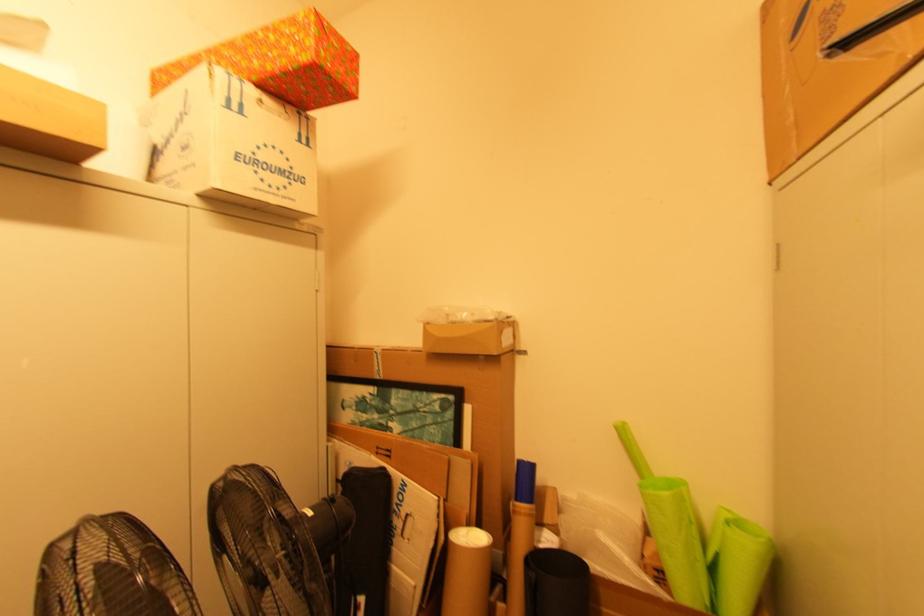
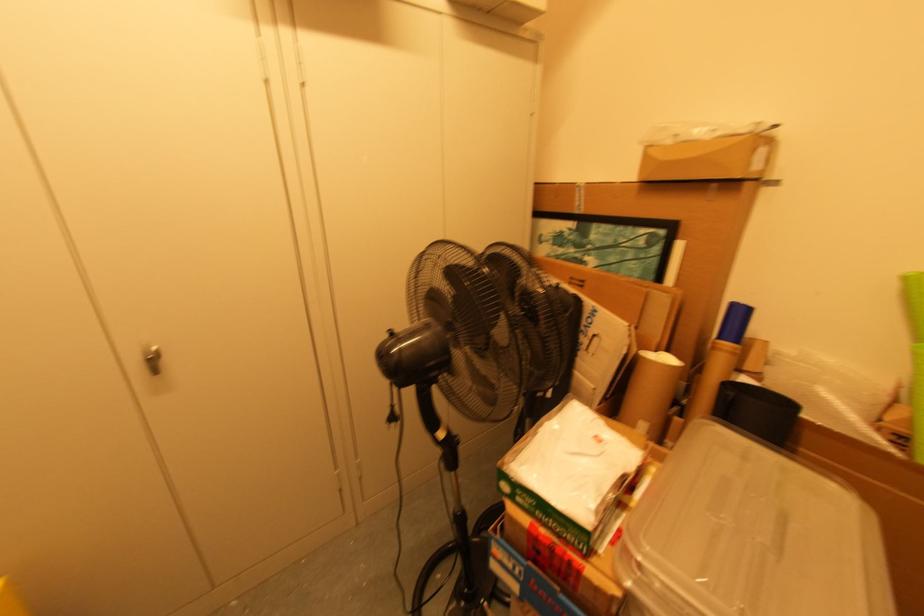
Where in the second image is the point corresponding to the point at 419,394 from the first image?

(622, 228)